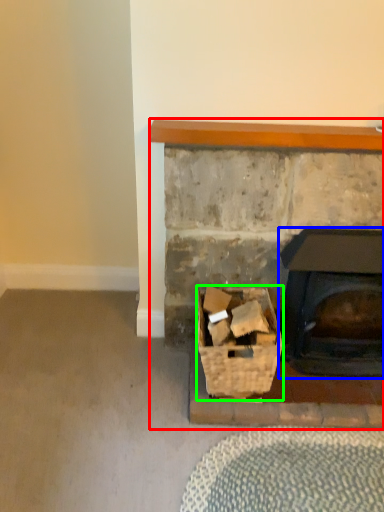
Question: Considering the real-world distances, which object is closest to fireplace (highlighted by a red box)? wood burning stove (highlighted by a blue box) or basket (highlighted by a green box).

Choices:
 (A) wood burning stove
 (B) basket

Answer: (A)